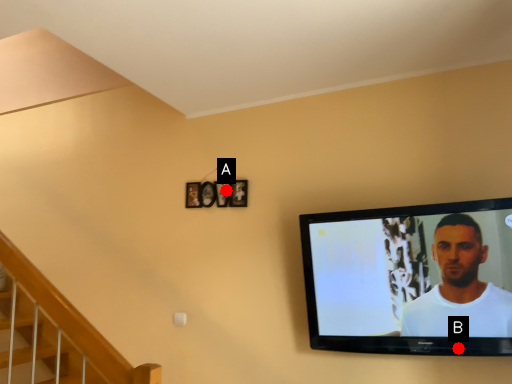
Question: Two points are circled on the image, labeled by A and B beside each circle. Which point is closer to the camera?

Choices:
 (A) A is closer
 (B) B is closer

Answer: (B)